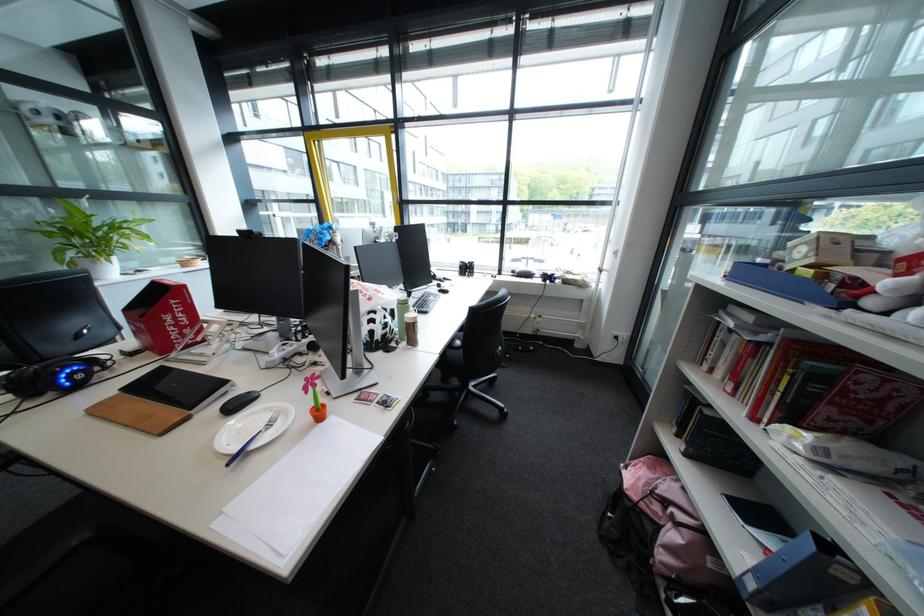
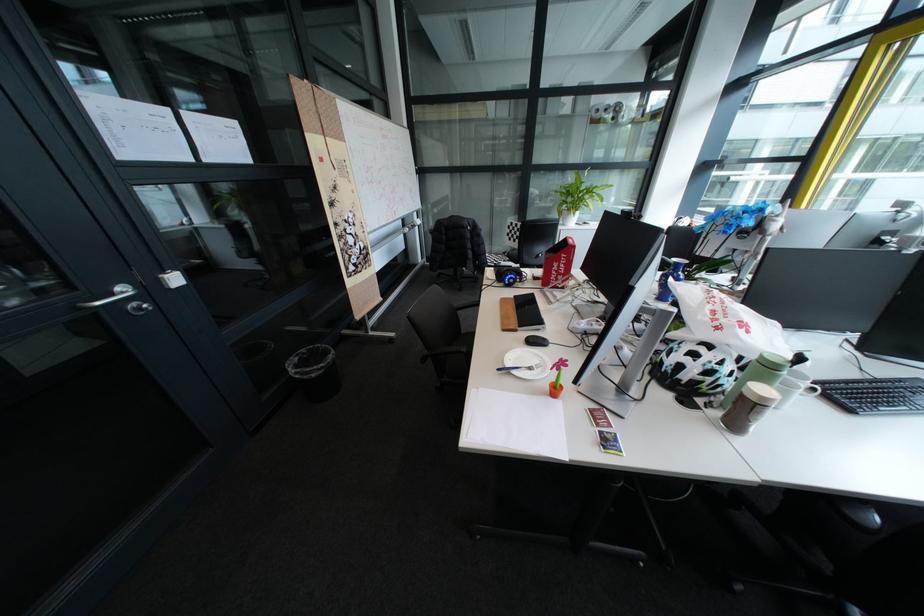
In the second image, find the point that corresponds to (x=412, y=341) in the first image.

(728, 406)